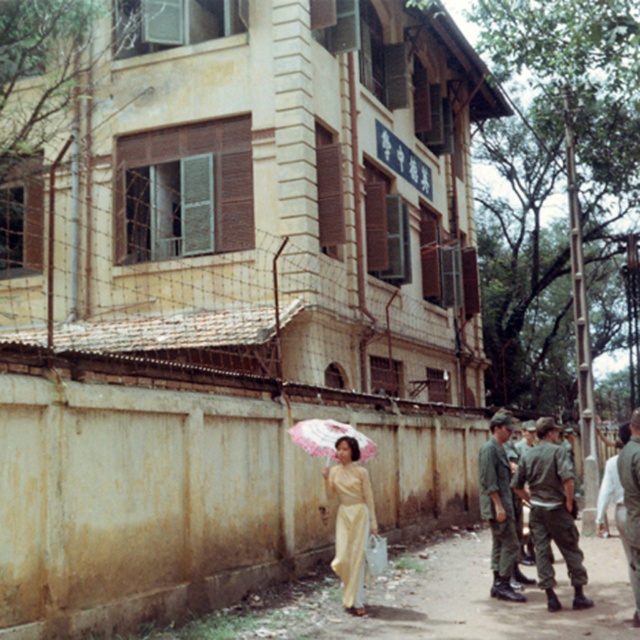
Looking at this image, who is shorter, camouflage fabric uniform at center or camouflage fabric uniform at right?

camouflage fabric uniform at center is shorter.

Does camouflage fabric uniform at center have a greater width compared to camouflage fabric uniform at right?

Yes.

Find the location of `camouflage fabric uniform at center`. camouflage fabric uniform at center is located at coordinates (552, 512).

Identify the location of camouflage fabric uniform at center. point(552,512).

Can you confirm if green military uniform at center is positioned to the right of pink fabric umbrella at center?

Indeed, green military uniform at center is positioned on the right side of pink fabric umbrella at center.

Is point (504, 508) positioned in front of point (332, 449)?

No, (504, 508) is behind (332, 449).

Where is `green military uniform at center`? green military uniform at center is located at coordinates (499, 506).

Is light yellow silk ao dai at center shorter than camouflage fabric uniform at right?

Yes.

This screenshot has width=640, height=640. Identify the location of light yellow silk ao dai at center. (349, 518).

Locate an element on the screen. light yellow silk ao dai at center is located at coordinates (349, 518).